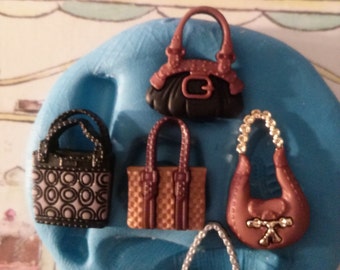
This screenshot has height=270, width=340. In order to click on decorative printing in this screenshot , I will do `click(62, 197)`, `click(46, 181)`, `click(83, 176)`.